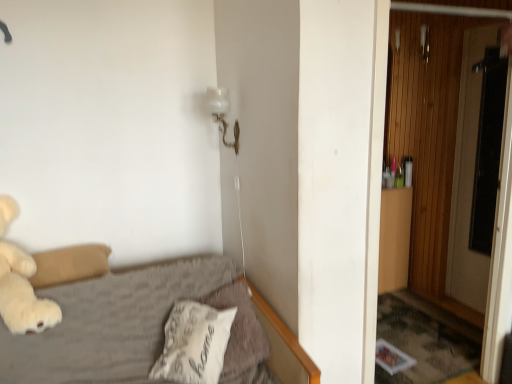
The width and height of the screenshot is (512, 384). I want to click on free spot in front of transparent glass screen door at right, so click(474, 317).